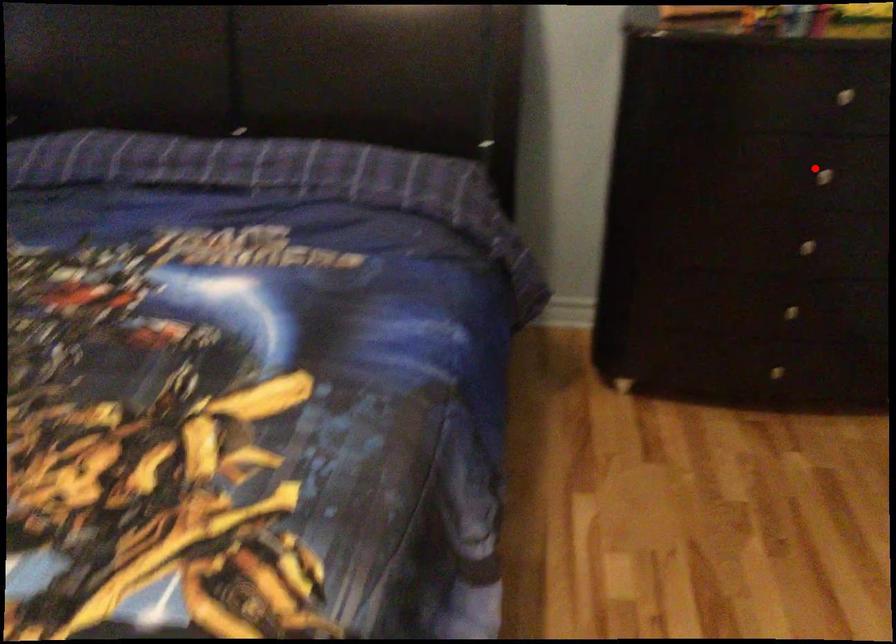
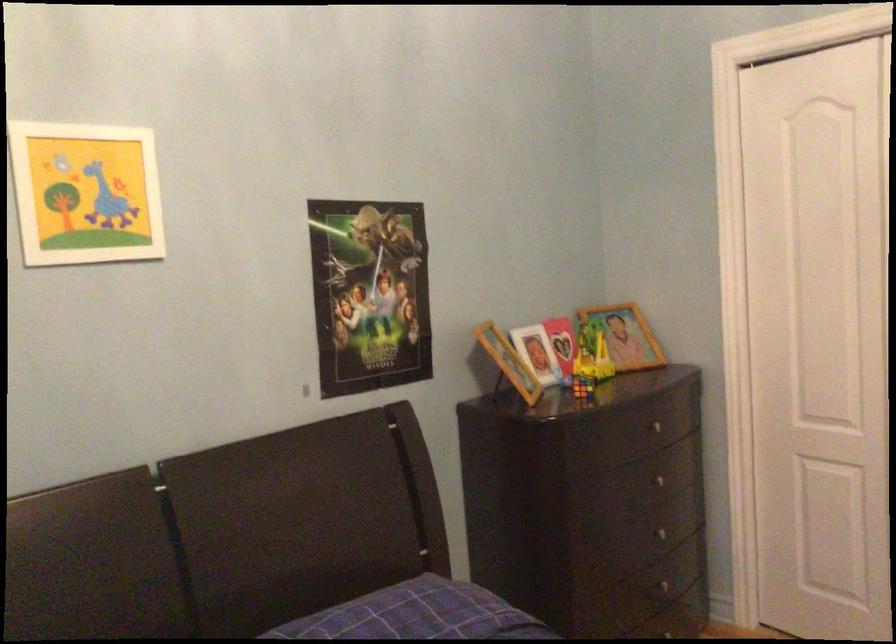
Question: I am providing you with two images of the same scene from different viewpoints. Given a red point in image1, look at the same physical point in image2. Is it:

Choices:
 (A) Closer to the viewpoint
 (B) Farther from the viewpoint

Answer: (B)